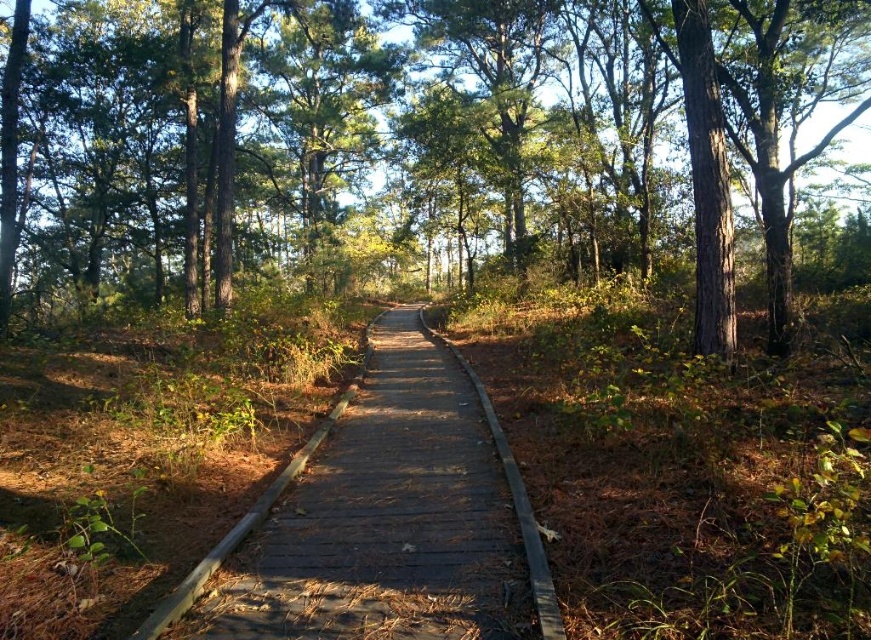
You are a hiker carrying a 2m wide tent. You see the green matte tree at center and the wooden boardwalk at center. Can you set up your tent between them without cutting down the tree?

The green matte tree at center is wider than the wooden boardwalk at center. Since the tree is wider, there may not be enough space between them to fit your 2m wide tent without overlapping the tree. You might need to look for a different spot where there is more space.

You are a hiker walking along the wooden boardwalk at center. You want to take a photo of the green matte tree at center. In which direction should you move relative to the boardwalk to get a clear view of the tree?

The green matte tree at center is to the left of the wooden boardwalk at center, so you should move to the left side of the boardwalk to get a clear view of the tree.

You are standing at the starting point of the boardwalk and want to reach the green matte tree at center. In which direction should you walk relative to the boardwalk to reach it?

The green matte tree at center is located at point coordinates, so you should walk along the boardwalk towards the center to reach it.